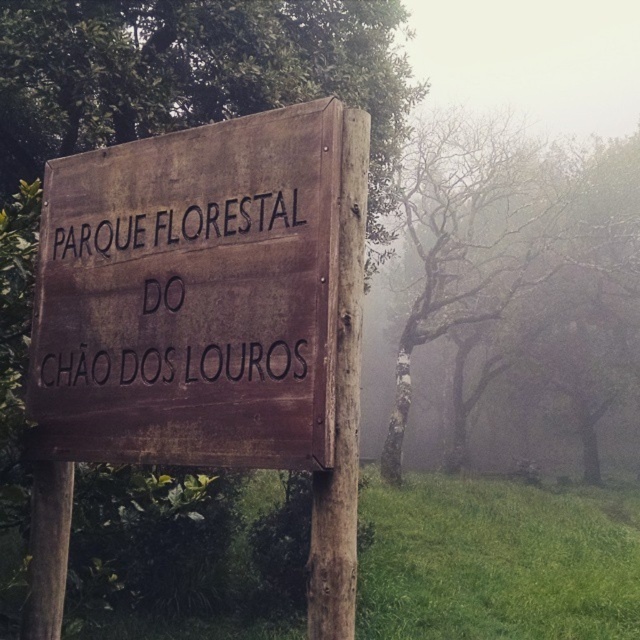
Question: From the image, what is the correct spatial relationship of brown wooden sign at center in relation to green matte signpost at center?

Choices:
 (A) above
 (B) below

Answer: (B)

Question: Which of the following is the closest to the observer?

Choices:
 (A) (483, 160)
 (B) (33, 164)

Answer: (B)

Question: Among these objects, which one is farthest from the camera?

Choices:
 (A) green matte signpost at center
 (B) brown wooden sign at center

Answer: (A)

Question: Among these points, which one is nearest to the camera?

Choices:
 (A) (104, 429)
 (B) (433, 291)
 (C) (284, 24)

Answer: (A)

Question: Does green matte signpost at center have a lesser width compared to bare branches at center?

Choices:
 (A) no
 (B) yes

Answer: (B)

Question: Is brown wooden sign at center smaller than bare branches at center?

Choices:
 (A) yes
 (B) no

Answer: (A)